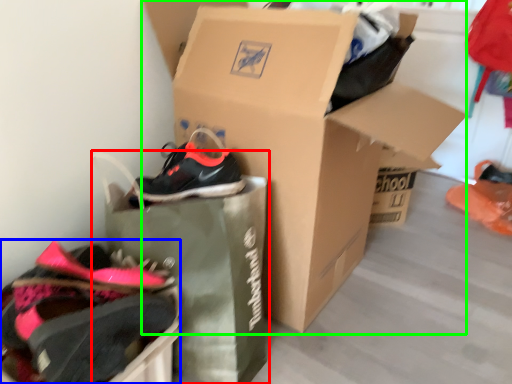
Question: Which is nearer to the shopping bag (highlighted by a red box)? footwear (highlighted by a blue box) or box (highlighted by a green box).

Choices:
 (A) footwear
 (B) box

Answer: (A)